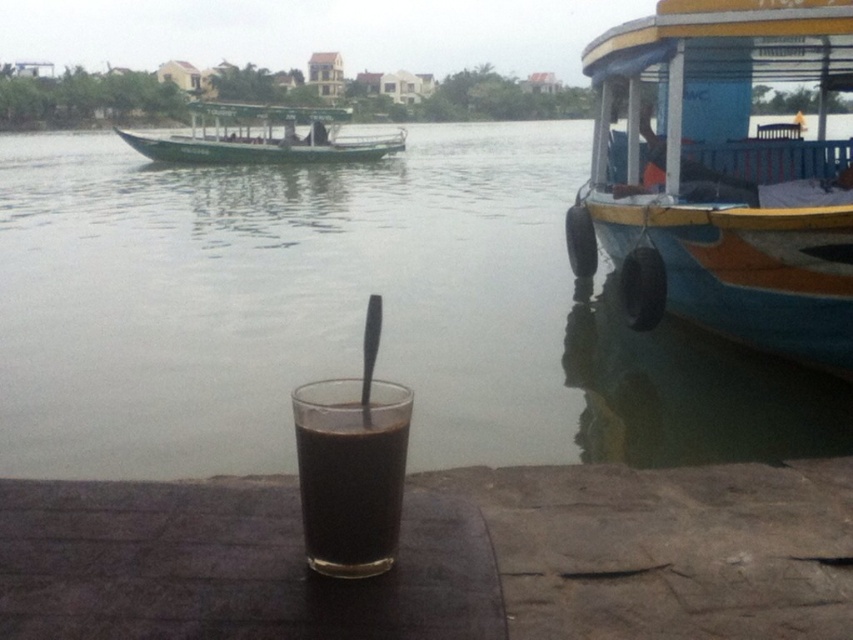
Question: Based on their relative distances, which object is nearer to the blue painted wood boat at right?

Choices:
 (A) transparent glass at center
 (B) green matte boat at upper left
 (C) black glass at center

Answer: (A)

Question: Does transparent glass at center have a smaller size compared to green matte boat at upper left?

Choices:
 (A) no
 (B) yes

Answer: (B)

Question: Which point is closer to the camera taking this photo?

Choices:
 (A) (320, 432)
 (B) (845, 406)

Answer: (A)

Question: Does black glass at center appear on the left side of green matte boat at upper left?

Choices:
 (A) yes
 (B) no

Answer: (B)

Question: Is transparent glass at center above black glass at center?

Choices:
 (A) yes
 (B) no

Answer: (A)

Question: Which of the following is the farthest from the observer?

Choices:
 (A) (283, 225)
 (B) (337, 419)
 (C) (302, 156)

Answer: (C)